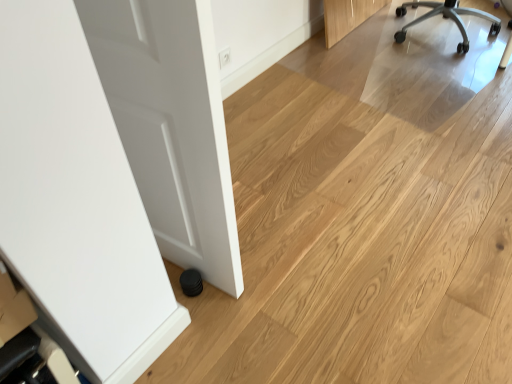
Question: Looking at the image, does silver metallic chair at upper right seem bigger or smaller compared to white glossy door at left?

Choices:
 (A) small
 (B) big

Answer: (B)

Question: Considering the positions of silver metallic chair at upper right and white glossy door at left in the image, is silver metallic chair at upper right taller or shorter than white glossy door at left?

Choices:
 (A) short
 (B) tall

Answer: (A)

Question: From the image's perspective, relative to white glossy door at left, is silver metallic chair at upper right above or below?

Choices:
 (A) below
 (B) above

Answer: (B)

Question: Considering the positions of white glossy door at left and silver metallic chair at upper right in the image, is white glossy door at left wider or thinner than silver metallic chair at upper right?

Choices:
 (A) wide
 (B) thin

Answer: (B)

Question: Considering their positions, is white glossy door at left located in front of or behind silver metallic chair at upper right?

Choices:
 (A) front
 (B) behind

Answer: (A)

Question: Is white glossy door at left taller or shorter than silver metallic chair at upper right?

Choices:
 (A) tall
 (B) short

Answer: (A)

Question: In terms of size, does white glossy door at left appear bigger or smaller than silver metallic chair at upper right?

Choices:
 (A) big
 (B) small

Answer: (B)